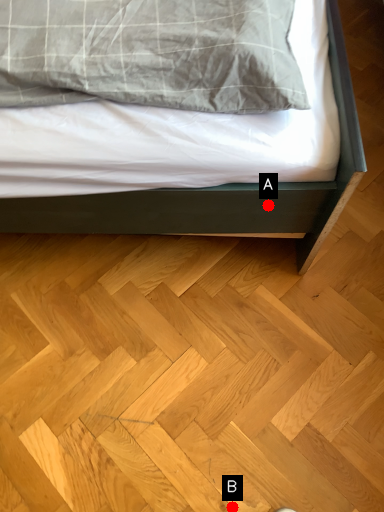
Question: Two points are circled on the image, labeled by A and B beside each circle. Which point is farther from the camera taking this photo?

Choices:
 (A) A is further
 (B) B is further

Answer: (B)